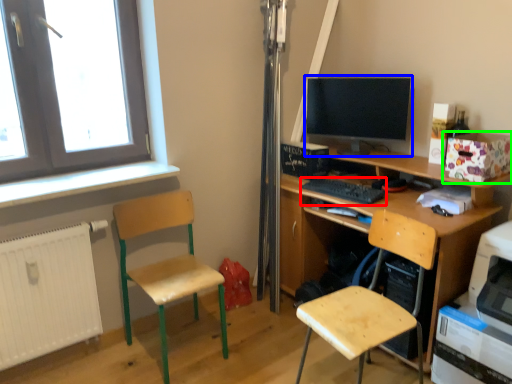
Question: Considering the real-world distances, which object is closest to keyboard (highlighted by a red box)? computer monitor (highlighted by a blue box) or box (highlighted by a green box).

Choices:
 (A) computer monitor
 (B) box

Answer: (A)